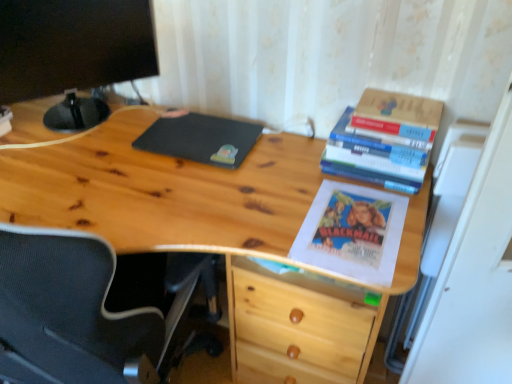
Locate an element on the screen. The image size is (512, 384). vacant space in front of black matte computer monitor at upper left is located at coordinates (76, 169).